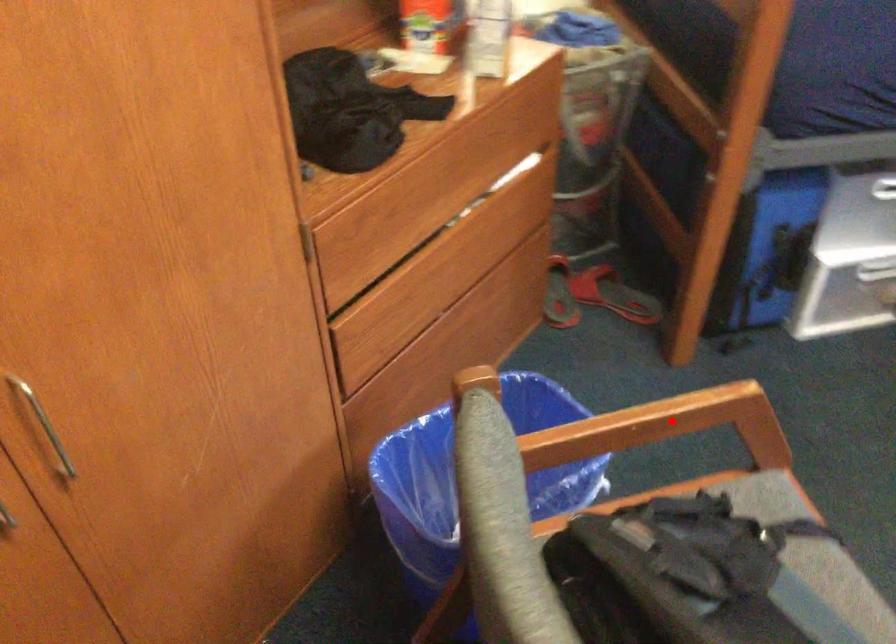
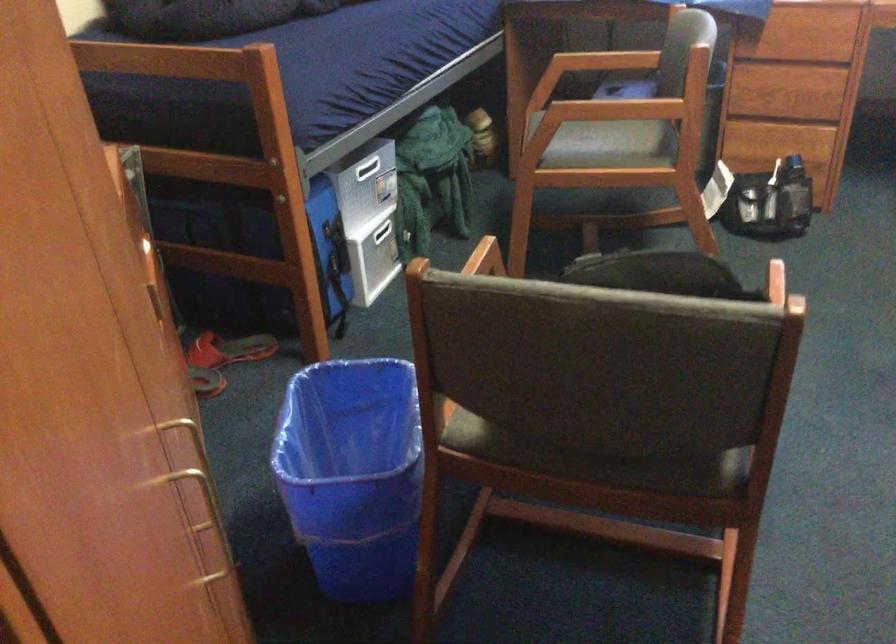
Question: I am providing you with two images of the same scene from different viewpoints. A red point is marked on the first image. Can you still see the location of the red point in image 2?

Choices:
 (A) Yes
 (B) No

Answer: (B)